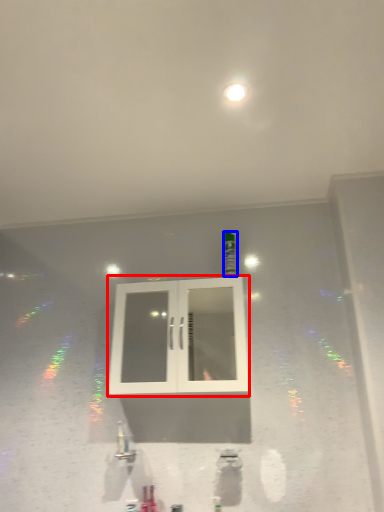
Question: Which object appears farthest to the camera in this image, window (highlighted by a red box) or bottle (highlighted by a blue box)?

Choices:
 (A) window
 (B) bottle

Answer: (B)